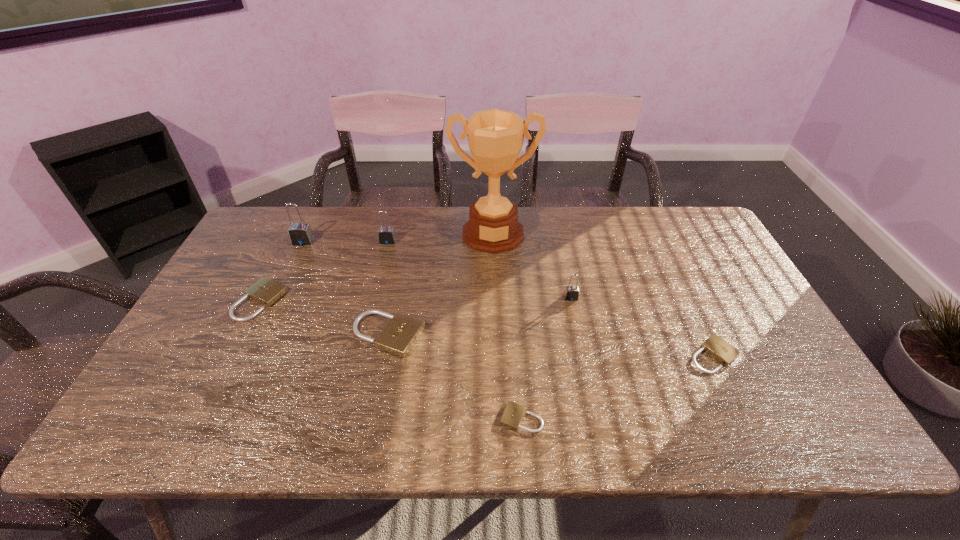
The width and height of the screenshot is (960, 540). I want to click on vacant point located between the fifth shortest object and the seventh shortest object, so click(x=437, y=269).

Where is `free spot between the fifth tallest padlock and the award`? free spot between the fifth tallest padlock and the award is located at coordinates (377, 267).

This screenshot has height=540, width=960. What are the coordinates of `object that can be found as the seventh closest to the shortest object` in the screenshot? It's located at (300, 234).

Image resolution: width=960 pixels, height=540 pixels. Find the location of `object that is the fifth closest to the biggest beige padlock`. object that is the fifth closest to the biggest beige padlock is located at coordinates (300, 234).

Select which padlock appears as the fifth closest to the tallest object. Please provide its 2D coordinates. Your answer should be formatted as a tuple, i.e. [(x, y)], where the tuple contains the x and y coordinates of a point satisfying the conditions above.

[(265, 291)]

Point out which padlock is positioned as the nearest to the leftmost beige padlock. Please provide its 2D coordinates. Your answer should be formatted as a tuple, i.e. [(x, y)], where the tuple contains the x and y coordinates of a point satisfying the conditions above.

[(300, 234)]

Where is `gray padlock that is the third closest one to the leftmost beige padlock`? gray padlock that is the third closest one to the leftmost beige padlock is located at coordinates (571, 293).

Locate which gray padlock is the second closest to the biggest beige padlock. Please provide its 2D coordinates. Your answer should be formatted as a tuple, i.e. [(x, y)], where the tuple contains the x and y coordinates of a point satisfying the conditions above.

[(300, 234)]

At what (x,y) coordinates should I click in order to perform the action: click on the second closest beige padlock to the sixth padlock from left to right. Please return your answer as a coordinate pair (x, y). This screenshot has width=960, height=540. Looking at the image, I should click on (513, 414).

This screenshot has height=540, width=960. What are the coordinates of `beige padlock that can be found as the closest to the biggest beige padlock` in the screenshot? It's located at (265, 291).